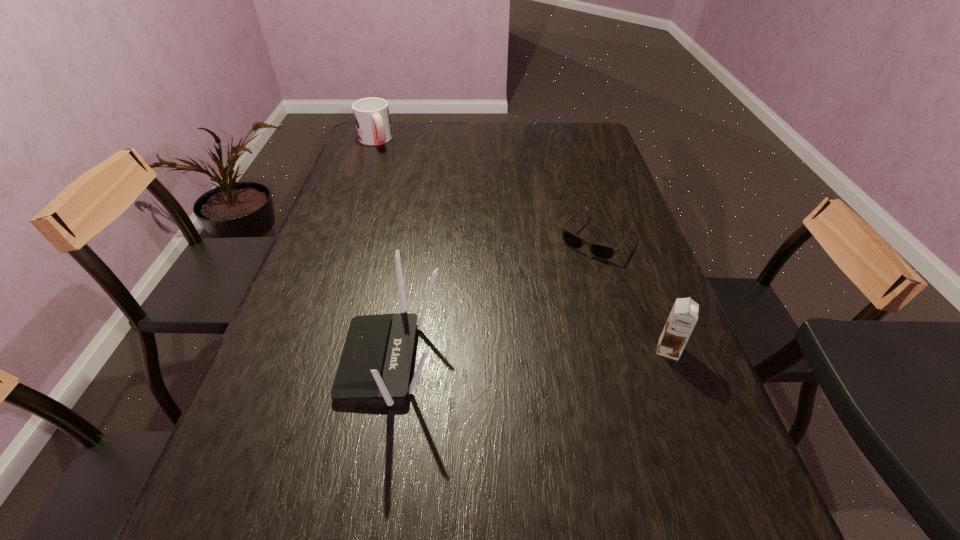
You are a GUI agent. You are given a task and a screenshot of the screen. Output one action in this format:
    pyautogui.click(x=<x>, y=<y>)
    Task: Click on the second object from left to right
    
    Given the screenshot: What is the action you would take?
    pyautogui.click(x=376, y=359)

The image size is (960, 540). Find the location of `the tallest object`. the tallest object is located at coordinates (376, 359).

The height and width of the screenshot is (540, 960). I want to click on chocolate milk, so pos(683,317).

Where is `mug`? mug is located at coordinates tap(372, 118).

This screenshot has width=960, height=540. Find the location of `the farthest object`. the farthest object is located at coordinates (372, 118).

In order to click on the shortest object in this screenshot , I will do `click(600, 251)`.

I want to click on sunglasses, so click(x=600, y=251).

Locate an element on the screen. The width and height of the screenshot is (960, 540). vacant space positioned 0.060m on the front-facing side of the third object from right to left is located at coordinates tap(315, 360).

At what (x,y) coordinates should I click in order to perform the action: click on blank space located on the front-facing side of the third object from right to left. Please return your answer as a coordinate pair (x, y). The image size is (960, 540). Looking at the image, I should click on (268, 360).

Where is `free space located on the back of the chocolate milk`? Image resolution: width=960 pixels, height=540 pixels. free space located on the back of the chocolate milk is located at coordinates (623, 230).